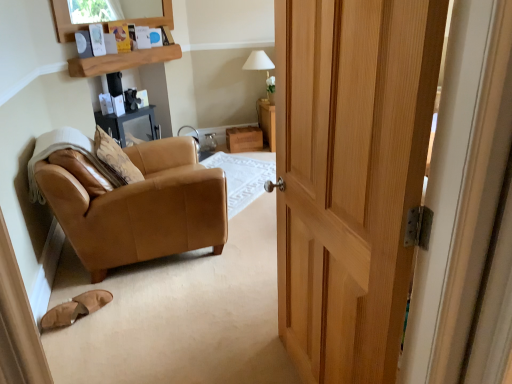
Where is `free space in front of tan leather chair at left`? The image size is (512, 384). free space in front of tan leather chair at left is located at coordinates (165, 319).